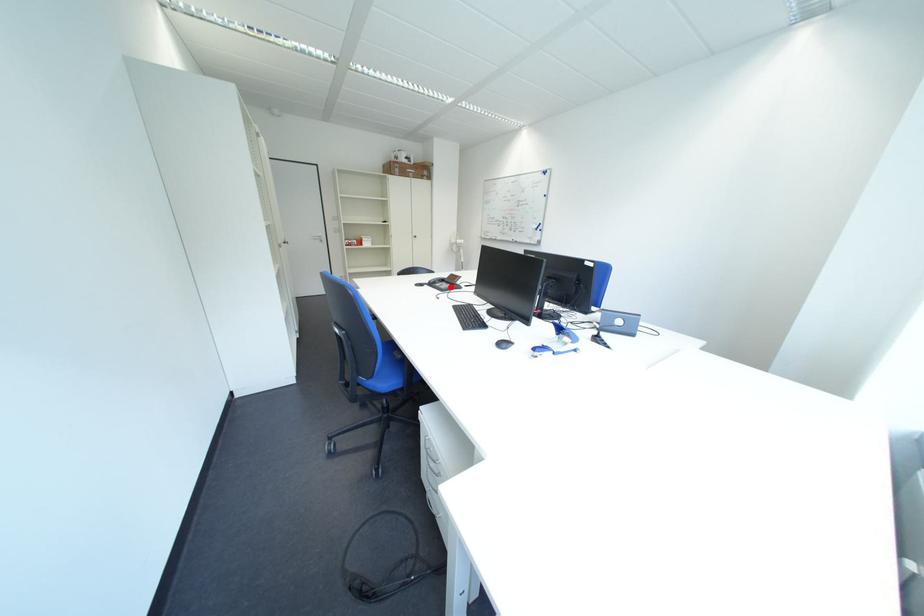
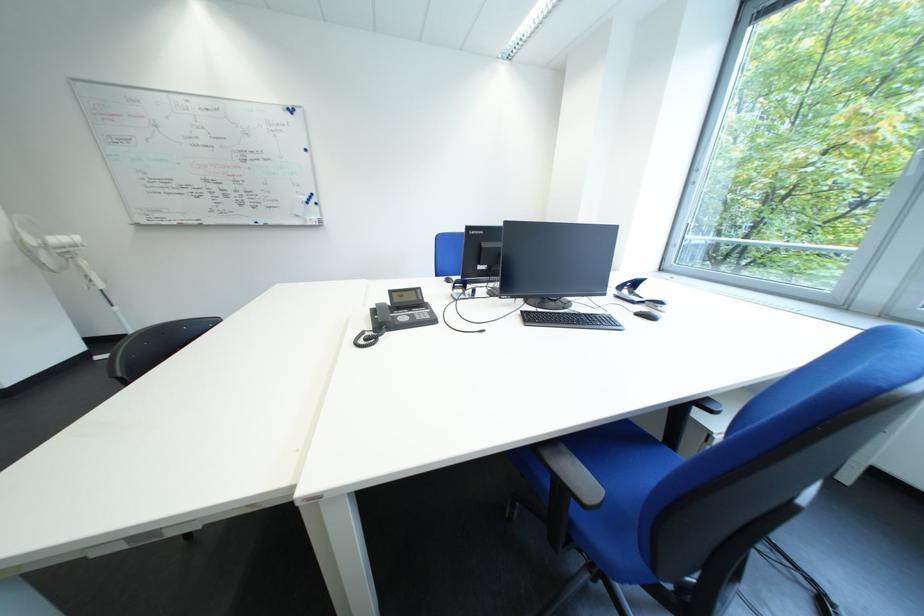
In the second image, find the point that corresponds to the highlighted location in the first image.

(416, 320)